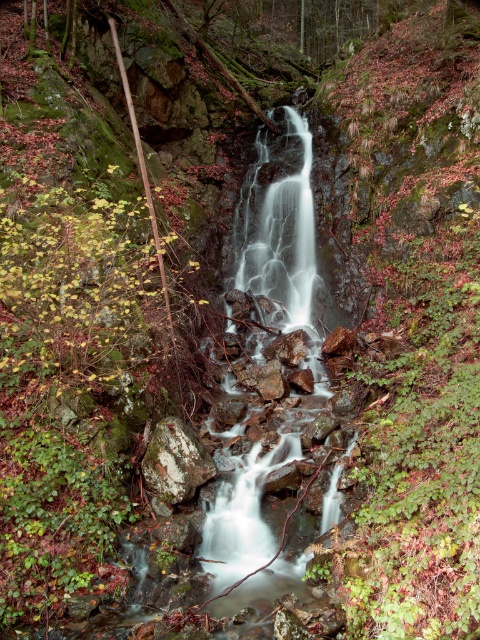
You are standing in front of the waterfall scene. You notice the white smooth water at center and the speckled rock at center. Which object is nearer to you?

The white smooth water at center is closer to the viewer than the speckled rock at center.

You are standing at the base of the waterfall and want to take a photo of both the point at coordinates point [288,380] and point [155,474]. Which point will appear closer to the camera in your photo?

Point [155,474] will appear closer to the camera in the photo because it is physically closer to the camera than point [288,380], which is further away.

You are a photographer wanting to capture the waterfall and the surrounding area. You notice the white smooth water at center and the speckled rock at center. Which object appears taller in the image?

The white smooth water at center appears taller than the speckled rock at center in the image.